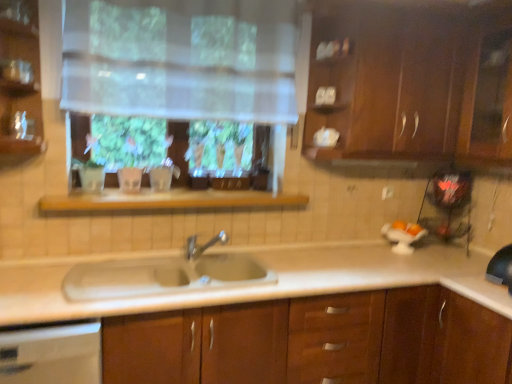
Question: Considering the relative sizes of white porcelain sink at center and white glossy dishwasher at lower left in the image provided, is white porcelain sink at center wider than white glossy dishwasher at lower left?

Choices:
 (A) yes
 (B) no

Answer: (B)

Question: Is white porcelain sink at center far away from white glossy dishwasher at lower left?

Choices:
 (A) yes
 (B) no

Answer: (B)

Question: From a real-world perspective, is white porcelain sink at center physically below white glossy dishwasher at lower left?

Choices:
 (A) yes
 (B) no

Answer: (B)

Question: Can you confirm if white porcelain sink at center is thinner than white glossy dishwasher at lower left?

Choices:
 (A) no
 (B) yes

Answer: (B)

Question: Is white glossy dishwasher at lower left at the back of white porcelain sink at center?

Choices:
 (A) no
 (B) yes

Answer: (A)

Question: Looking at the image, does dark wood cabinet at upper right, which is the 1th cabinetry from top to bottom, seem bigger or smaller compared to translucent fabric at upper center?

Choices:
 (A) big
 (B) small

Answer: (A)

Question: Is dark wood cabinet at upper right, which is the 1th cabinetry from top to bottom, to the left or to the right of translucent fabric at upper center in the image?

Choices:
 (A) right
 (B) left

Answer: (A)

Question: Choose the correct answer: Is dark wood cabinet at upper right, which is the 1th cabinetry from top to bottom, inside translucent fabric at upper center or outside it?

Choices:
 (A) inside
 (B) outside

Answer: (B)

Question: Is dark wood cabinet at upper right, which is the 1th cabinetry from top to bottom, wider or thinner than translucent fabric at upper center?

Choices:
 (A) wide
 (B) thin

Answer: (A)

Question: Considering the positions of silver metallic faucet at center and white porcelain sink at center in the image, is silver metallic faucet at center wider or thinner than white porcelain sink at center?

Choices:
 (A) wide
 (B) thin

Answer: (B)

Question: From a real-world perspective, is silver metallic faucet at center physically located above or below white porcelain sink at center?

Choices:
 (A) above
 (B) below

Answer: (A)

Question: Considering their positions, is silver metallic faucet at center located in front of or behind white porcelain sink at center?

Choices:
 (A) behind
 (B) front

Answer: (A)

Question: Considering the positions of point (223, 243) and point (116, 286), is point (223, 243) closer or farther from the camera than point (116, 286)?

Choices:
 (A) closer
 (B) farther

Answer: (B)

Question: Considering the relative positions of translucent fabric at upper center and wooden shelf at center in the image provided, is translucent fabric at upper center to the left or to the right of wooden shelf at center?

Choices:
 (A) left
 (B) right

Answer: (B)

Question: From the image's perspective, is translucent fabric at upper center positioned above or below wooden shelf at center?

Choices:
 (A) above
 (B) below

Answer: (A)